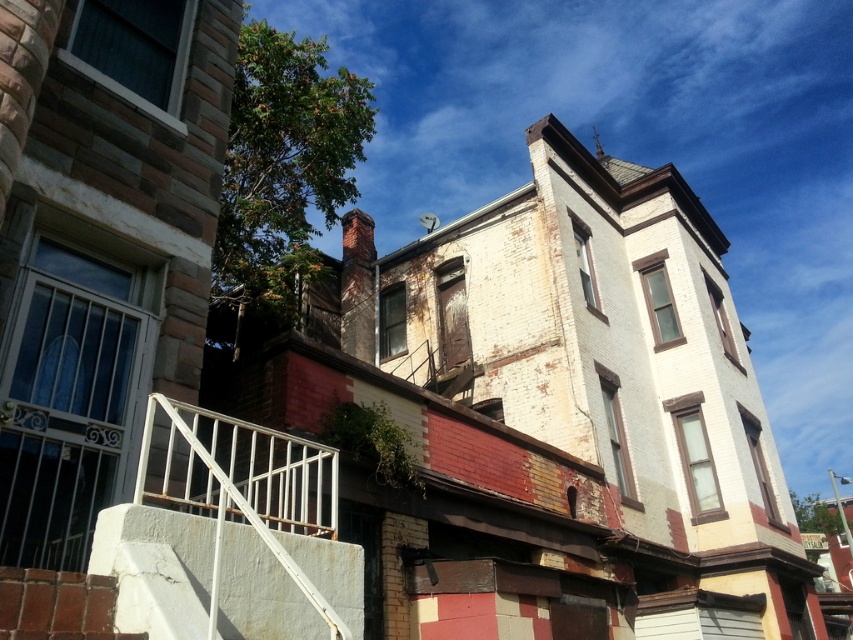
You are a delivery person carrying a heavy package and need to climb the white concrete stairs at lower left. The white metal railing at lower left is available for support. Considering their heights, which one should you focus on for stability?

The white metal railing at lower left is taller than the white concrete stairs at lower left, so you should focus on the white metal railing at lower left for better stability when climbing the stairs.

You are standing in front of the residential buildings and want to take a photo. You notice two points marked as point 1 and point 2. If point 1 is at coordinate (309,554) and point 2 is at (315,605), which point is closer to your camera lens?

Point 1 at coordinate (309,554) is closer to the camera lens because it is further to the camera than point 2 at (315,605).

You are a delivery person carrying a large package that is 28 inches wide. You need to navigate through the space between the white concrete stairs at lower left and the white metal railing at lower left. Can you fit through this space with your package?

The space between the white concrete stairs at lower left and the white metal railing at lower left is 26.20 inches. Since your package is 28 inches wide, it is wider than the available space, so you cannot fit through this space with your package.